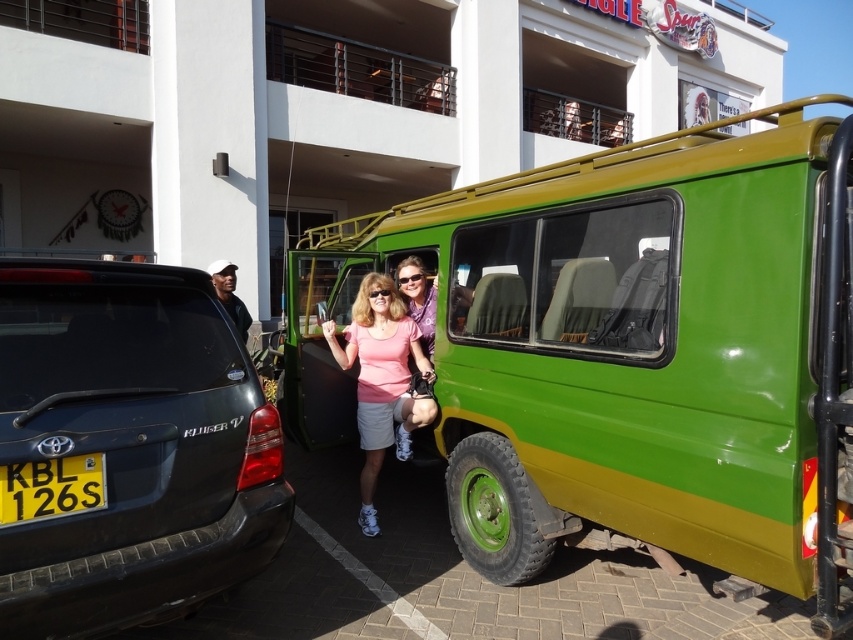
Question: Among these objects, which one is nearest to the camera?

Choices:
 (A) pink matte shirt at center
 (B) black fabric cap at left
 (C) black plastic license plate at lower left
 (D) green matte van at center

Answer: (C)

Question: In this image, where is matte black suv at left located relative to black plastic license plate at lower left?

Choices:
 (A) right
 (B) left

Answer: (A)

Question: Does matte black suv at left have a greater width compared to black fabric cap at left?

Choices:
 (A) no
 (B) yes

Answer: (B)

Question: Based on their relative distances, which object is farther from the black plastic license plate at lower left?

Choices:
 (A) pink matte shirt at center
 (B) matte black suv at left
 (C) black fabric cap at left
 (D) green matte van at center

Answer: (C)

Question: Can you confirm if green matte van at center is positioned below black fabric cap at left?

Choices:
 (A) yes
 (B) no

Answer: (A)

Question: Which object is the farthest from the black fabric cap at left?

Choices:
 (A) matte black suv at left
 (B) black plastic license plate at lower left
 (C) pink matte shirt at center

Answer: (B)